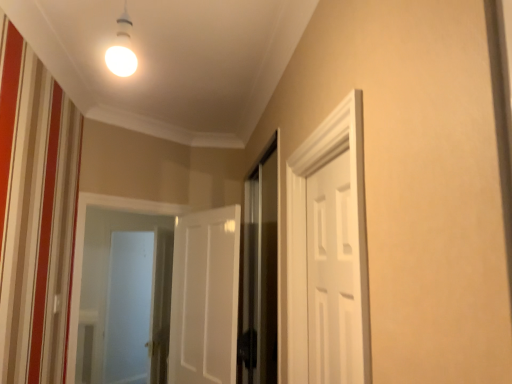
Question: Is white matte door at center, which is the 2th door in front-to-back order, smaller than white matte door at right, positioned as the 2th door in left-to-right order?

Choices:
 (A) no
 (B) yes

Answer: (A)

Question: Is white matte door at center, which is the first door in back-to-front order, turned away from white matte door at right, which ranks as the 2th door in back-to-front order?

Choices:
 (A) yes
 (B) no

Answer: (B)

Question: Is white matte door at center, which is the 2th door in front-to-back order, facing towards white matte door at right, positioned as the 2th door in left-to-right order?

Choices:
 (A) yes
 (B) no

Answer: (B)

Question: From a real-world perspective, is white matte door at center, positioned as the first door in left-to-right order, over white matte door at right, acting as the first door starting from the front?

Choices:
 (A) no
 (B) yes

Answer: (A)

Question: Can you confirm if white matte door at center, which is the 2th door in front-to-back order, is bigger than white matte door at right, marked as the 1th door in a right-to-left arrangement?

Choices:
 (A) no
 (B) yes

Answer: (B)

Question: Considering the relative positions of white matte door at center, which is the first door in back-to-front order, and white matte door at right, which ranks as the 2th door in back-to-front order, in the image provided, is white matte door at center, which is the first door in back-to-front order, to the left or to the right of white matte door at right, which ranks as the 2th door in back-to-front order,?

Choices:
 (A) right
 (B) left

Answer: (B)

Question: Considering the positions of point (189, 269) and point (352, 261), is point (189, 269) closer or farther from the camera than point (352, 261)?

Choices:
 (A) farther
 (B) closer

Answer: (A)

Question: Considering their positions, is white matte door at center, positioned as the first door in left-to-right order, located in front of or behind white matte door at right, marked as the 1th door in a right-to-left arrangement?

Choices:
 (A) front
 (B) behind

Answer: (B)

Question: From a real-world perspective, is white matte door at center, which is the first door in back-to-front order, above or below white matte door at right, marked as the 1th door in a right-to-left arrangement?

Choices:
 (A) above
 (B) below

Answer: (B)

Question: Is frosted glass screen door at left, the 2th screen door viewed from the front, in front of or behind white matte door at right, marked as the 1th door in a right-to-left arrangement, in the image?

Choices:
 (A) behind
 (B) front

Answer: (A)

Question: From the image's perspective, is frosted glass screen door at left, the 2th screen door viewed from the right, positioned above or below white matte door at right, which ranks as the 2th door in back-to-front order?

Choices:
 (A) below
 (B) above

Answer: (A)

Question: Is point (134, 299) positioned closer to the camera than point (307, 291)?

Choices:
 (A) closer
 (B) farther

Answer: (B)

Question: Choose the correct answer: Is frosted glass screen door at left, the first screen door viewed from the left, inside white matte door at right, which ranks as the 2th door in back-to-front order, or outside it?

Choices:
 (A) inside
 (B) outside

Answer: (B)

Question: Is white matte door at center, which is the first door in back-to-front order, bigger or smaller than transparent glass screen door at center, acting as the second screen door starting from the back?

Choices:
 (A) small
 (B) big

Answer: (A)

Question: Considering the relative positions of white matte door at center, arranged as the second door when viewed from the right, and transparent glass screen door at center, acting as the second screen door starting from the back, in the image provided, is white matte door at center, arranged as the second door when viewed from the right, to the left or to the right of transparent glass screen door at center, acting as the second screen door starting from the back,?

Choices:
 (A) left
 (B) right

Answer: (A)